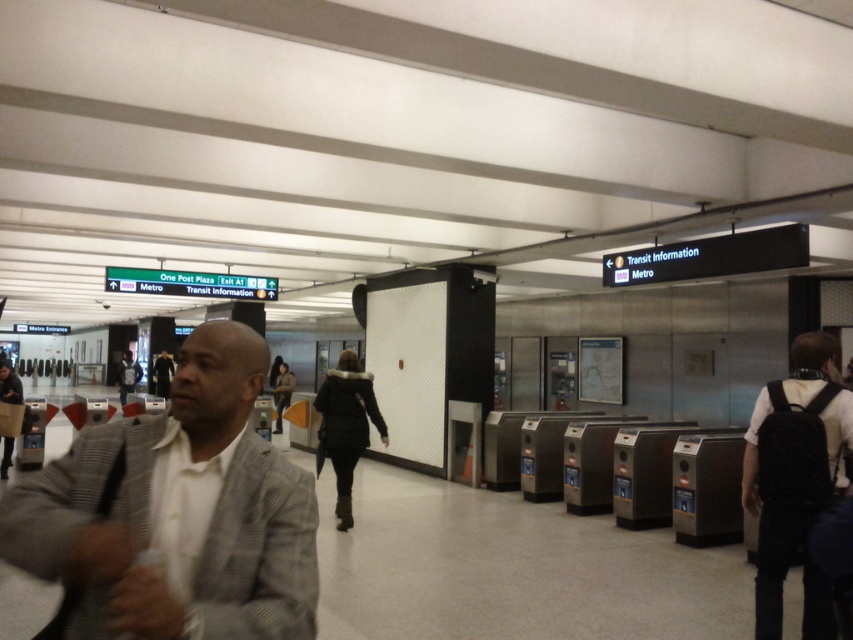
You are a security guard in the transit station. You notice a gray textured blazer at center and a black backpack at right. Which item is taller?

The gray textured blazer at center is not as tall as the black backpack at right, so the black backpack at right is taller.

You are a security guard in the transit station. You need to locate the gray textured blazer at center. According to the coordinates provided, where exactly is it positioned?

The gray textured blazer at center is positioned at coordinates point (178, 513).